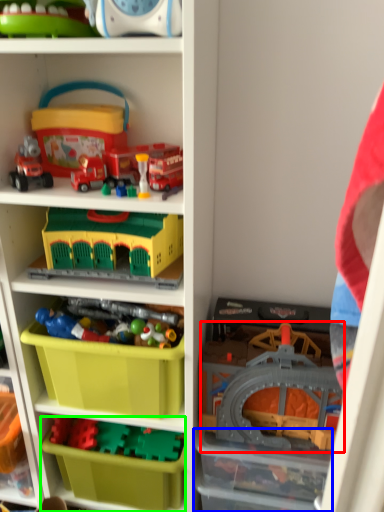
Question: Which object is the closest to the toy (highlighted by a red box)? Choose among these: storage box (highlighted by a blue box) or storage box (highlighted by a green box).

Choices:
 (A) storage box
 (B) storage box

Answer: (A)